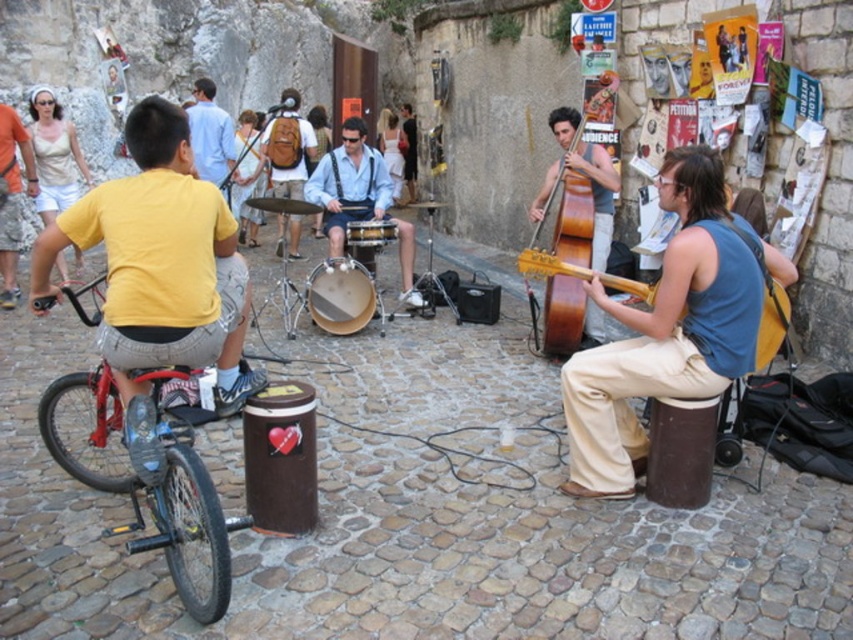
Who is positioned more to the right, smooth brown drum at center or wooden drum at center?

From the viewer's perspective, wooden drum at center appears more on the right side.

Between smooth brown drum at center and wooden drum at center, which one appears on the left side from the viewer's perspective?

Positioned to the left is smooth brown drum at center.

Between point (323, 291) and point (374, 241), which one is positioned in front?

Point (374, 241) is in front.

The height and width of the screenshot is (640, 853). Identify the location of smooth brown drum at center. (340, 296).

Based on the photo, can you confirm if light blue denim shorts at center is positioned to the right of light blue shirt at center?

Indeed, light blue denim shorts at center is positioned on the right side of light blue shirt at center.

Between light blue denim shorts at center and light blue shirt at center, which one is positioned lower?

light blue denim shorts at center is lower down.

Between point (370, 182) and point (218, 184), which one is positioned in front?

Point (370, 182)

The width and height of the screenshot is (853, 640). Identify the location of light blue denim shorts at center. (358, 198).

Can you confirm if blue sleeveless shirt at center is shorter than light blue shirt at center?

No.

How far apart are blue sleeveless shirt at center and light blue shirt at center?

blue sleeveless shirt at center and light blue shirt at center are 7.31 meters apart from each other.

Find the location of a particular element. The width and height of the screenshot is (853, 640). blue sleeveless shirt at center is located at coordinates pos(666,330).